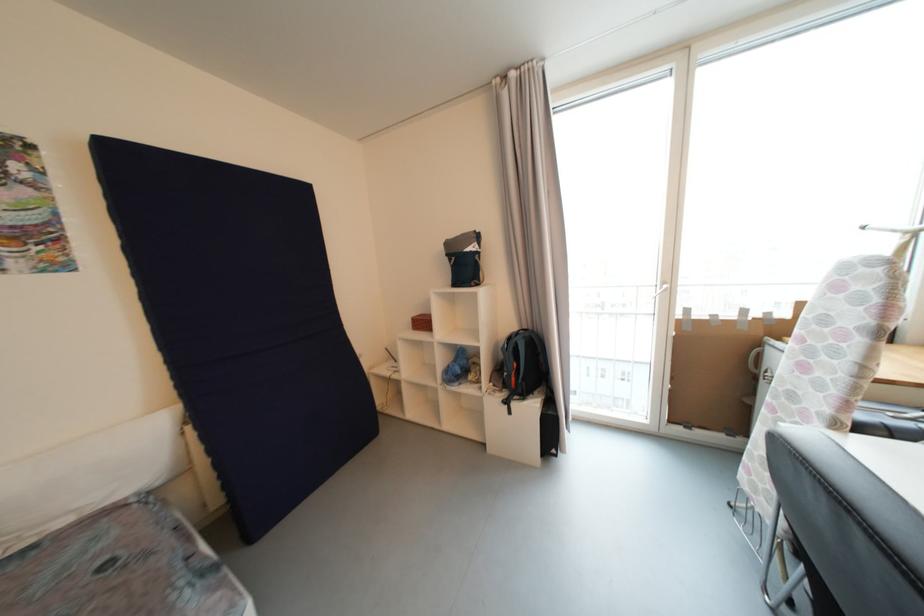
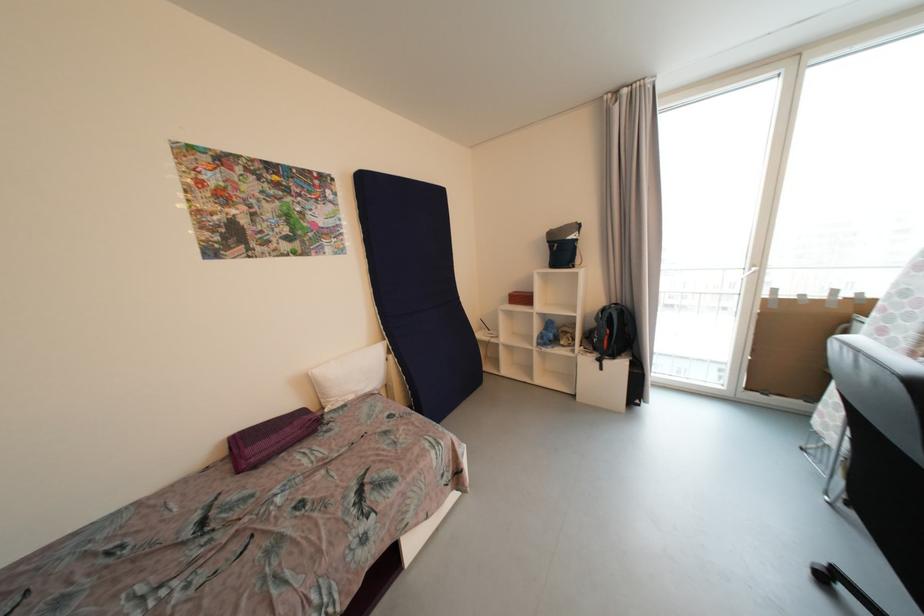
Locate, in the second image, the point that corresponds to (195,431) in the first image.

(396, 359)